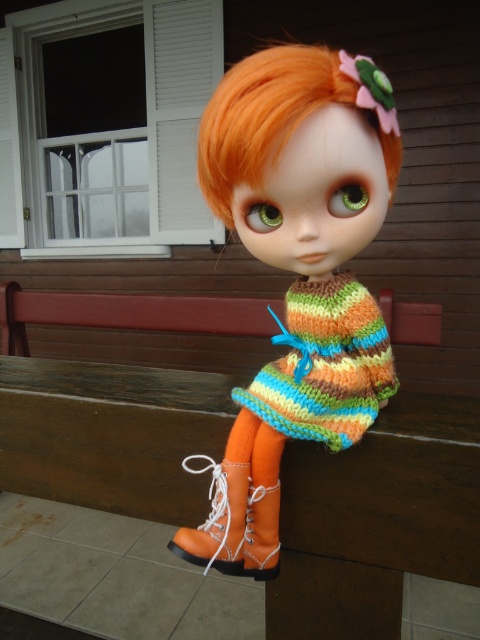
Question: Which point is farther to the camera?

Choices:
 (A) (252, 189)
 (B) (214, 186)

Answer: (B)

Question: Can you confirm if orange synthetic hair at center is positioned to the left of knitted multicolor sweater at center?

Choices:
 (A) no
 (B) yes

Answer: (B)

Question: Can you confirm if knitted sweater at center is positioned below orange leather boot at lower center?

Choices:
 (A) yes
 (B) no

Answer: (B)

Question: Which point is closer to the camera?

Choices:
 (A) knitted sweater at center
 (B) orange synthetic hair at center
 (C) knitted multicolor sweater at center

Answer: (B)

Question: Does knitted sweater at center appear on the right side of orange leather boot at lower center?

Choices:
 (A) no
 (B) yes

Answer: (B)

Question: Which object is closer to the camera taking this photo?

Choices:
 (A) knitted multicolor sweater at center
 (B) orange synthetic hair at center
 (C) knitted sweater at center
 (D) orange leather boot at lower center

Answer: (B)